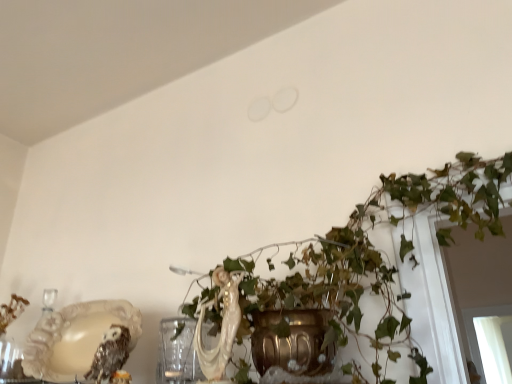
Measure the distance between point (x=210, y=352) and camera.

Point (x=210, y=352) is 35.04 inches from camera.

What do you see at coordinates (375, 249) in the screenshot? The image size is (512, 384). I see `green leafy plant at center` at bounding box center [375, 249].

Find the location of a particular element. This screenshot has height=384, width=512. shiny metallic owl at lower left is located at coordinates (110, 354).

From a real-world perspective, who is located lower, green leafy plant at center or shiny metallic owl at lower left?

shiny metallic owl at lower left.

Is point (361, 254) farther from camera compared to point (111, 336)?

No, (361, 254) is in front of (111, 336).

Who is shorter, green leafy plant at center or shiny metallic owl at lower left?

With less height is shiny metallic owl at lower left.

Is the depth of green leafy plant at center greater than that of shiny metallic owl at lower left?

No, it is not.

Considering the sizes of objects shiny metallic owl at lower left and white glossy cat at center in the image provided, who is wider, shiny metallic owl at lower left or white glossy cat at center?

shiny metallic owl at lower left is wider.

Which of these two, shiny metallic owl at lower left or white glossy cat at center, stands shorter?

Standing shorter between the two is shiny metallic owl at lower left.

Locate an element on the screen. This screenshot has width=512, height=384. animal lying in front of the shiny metallic owl at lower left is located at coordinates (221, 325).

How distant is shiny metallic owl at lower left from white glossy cat at center?

A distance of 9.98 inches exists between shiny metallic owl at lower left and white glossy cat at center.

From the image's perspective, is shiny metallic owl at lower left located above green leafy plant at center?

Incorrect, from the image's perspective, shiny metallic owl at lower left is lower than green leafy plant at center.

Is shiny metallic owl at lower left inside the boundaries of green leafy plant at center, or outside?

shiny metallic owl at lower left exists outside the volume of green leafy plant at center.

Is shiny metallic owl at lower left looking in the opposite direction of green leafy plant at center?

No.

Can you see white glossy cat at center touching green leafy plant at center?

No, white glossy cat at center is not with green leafy plant at center.

Between white glossy cat at center and green leafy plant at center, which one has larger size?

Bigger between the two is green leafy plant at center.

Consider the image. From a real-world perspective, which object stands above the other?

From a 3D spatial view, green leafy plant at center is above.

Does white glossy cat at center appear on the left side of green leafy plant at center?

Correct, you'll find white glossy cat at center to the left of green leafy plant at center.

Considering the positions of points (498, 216) and (203, 366), is point (498, 216) farther from camera compared to point (203, 366)?

Yes, point (498, 216) is behind point (203, 366).

From the image's perspective, which one is positioned lower, green leafy plant at center or white glossy cat at center?

white glossy cat at center appears lower in the image.

Is green leafy plant at center beside white glossy cat at center?

green leafy plant at center and white glossy cat at center are not in contact.

Can you confirm if white glossy cat at center is positioned to the left of shiny metallic owl at lower left?

No, white glossy cat at center is not to the left of shiny metallic owl at lower left.

From the picture: How far apart are white glossy cat at center and shiny metallic owl at lower left?

white glossy cat at center and shiny metallic owl at lower left are 9.98 inches apart.

Would you say white glossy cat at center is inside or outside shiny metallic owl at lower left?

white glossy cat at center exists outside the volume of shiny metallic owl at lower left.

What's the angular difference between white glossy cat at center and shiny metallic owl at lower left's facing directions?

They differ by 5.11 degrees in their facing directions.

Locate an element on the screen. This screenshot has height=384, width=512. owl lying on the left of green leafy plant at center is located at coordinates (110, 354).

You are a GUI agent. You are given a task and a screenshot of the screen. Output one action in this format:
    pyautogui.click(x=<x>, y=<y>)
    Task: Click on the owl below the white glossy cat at center (from a real-world perspective)
    The width and height of the screenshot is (512, 384).
    Given the screenshot: What is the action you would take?
    pyautogui.click(x=110, y=354)

When comparing their distances from green leafy plant at center, does shiny metallic owl at lower left or white glossy cat at center seem further?

shiny metallic owl at lower left lies further to green leafy plant at center than the other object.

From the image, which object appears to be farther from shiny metallic owl at lower left, white glossy cat at center or green leafy plant at center?

green leafy plant at center is further to shiny metallic owl at lower left.

Considering their positions, is white glossy cat at center positioned closer to green leafy plant at center than shiny metallic owl at lower left?

white glossy cat at center.

When comparing their distances from white glossy cat at center, does shiny metallic owl at lower left or green leafy plant at center seem closer?

shiny metallic owl at lower left is closer to white glossy cat at center.

From the image, which object appears to be farther from shiny metallic owl at lower left, green leafy plant at center or white glossy cat at center?

green leafy plant at center is positioned further to the anchor shiny metallic owl at lower left.

Which object lies nearer to the anchor point white glossy cat at center, green leafy plant at center or shiny metallic owl at lower left?

Based on the image, shiny metallic owl at lower left appears to be nearer to white glossy cat at center.

Image resolution: width=512 pixels, height=384 pixels. Identify the location of animal between green leafy plant at center and shiny metallic owl at lower left in the vertical direction. (221, 325).